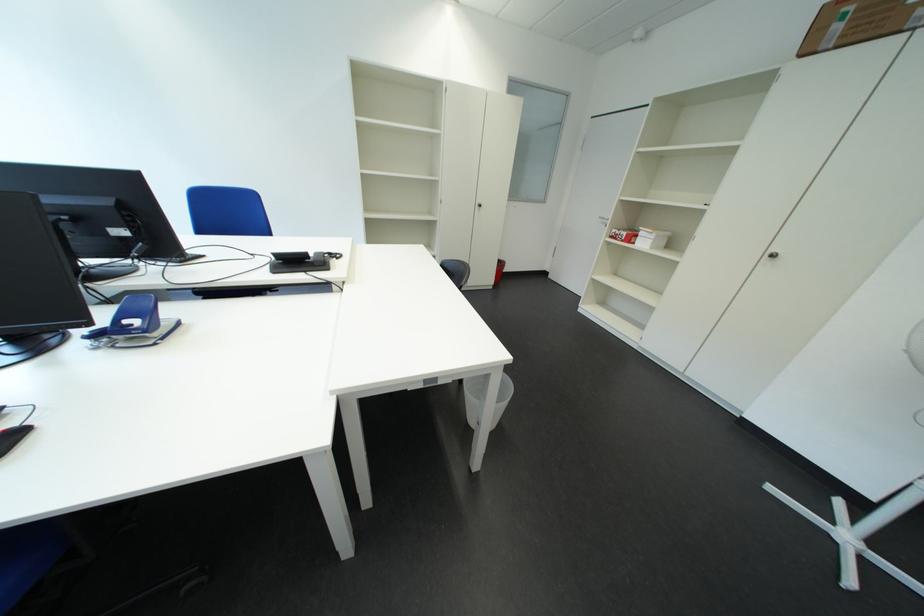
What do you see at coordinates (128, 321) in the screenshot? The width and height of the screenshot is (924, 616). I see `the hole punch lever` at bounding box center [128, 321].